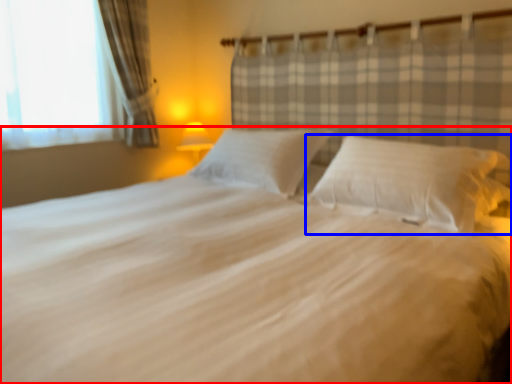
Question: Which of the following is the farthest to the observer, bed (highlighted by a red box) or pillow (highlighted by a blue box)?

Choices:
 (A) bed
 (B) pillow

Answer: (B)